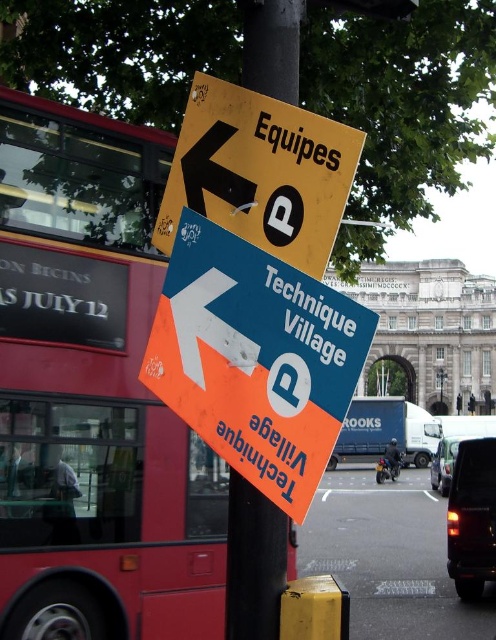
Who is more distant from viewer, (313, 129) or (453, 458)?

Positioned behind is point (453, 458).

Is point (262, 186) less distant than point (432, 465)?

That is True.

You are a GUI agent. You are given a task and a screenshot of the screen. Output one action in this format:
    pyautogui.click(x=<x>, y=<y>)
    Task: Click on the yellow matte sign at upper left
    
    Given the screenshot: What is the action you would take?
    pyautogui.click(x=260, y=172)

Is point (427, 465) positioned behind point (452, 452)?

Yes, point (427, 465) is behind point (452, 452).

Describe the element at coordinates (385, 432) in the screenshot. Image resolution: width=496 pixels, height=640 pixels. I see `blue metallic truck at center` at that location.

The height and width of the screenshot is (640, 496). What do you see at coordinates (385, 432) in the screenshot? I see `blue metallic truck at center` at bounding box center [385, 432].

Image resolution: width=496 pixels, height=640 pixels. What are the coordinates of `blue metallic truck at center` in the screenshot? It's located at (385, 432).

Is black plastic pole at center above blue metallic truck at center?

Correct, black plastic pole at center is located above blue metallic truck at center.

Can you confirm if black plastic pole at center is positioned below blue metallic truck at center?

No, black plastic pole at center is not below blue metallic truck at center.

Is point (278, 44) closer to viewer compared to point (372, 416)?

Yes.

Locate an element on the screen. This screenshot has height=640, width=496. black plastic pole at center is located at coordinates (253, 563).